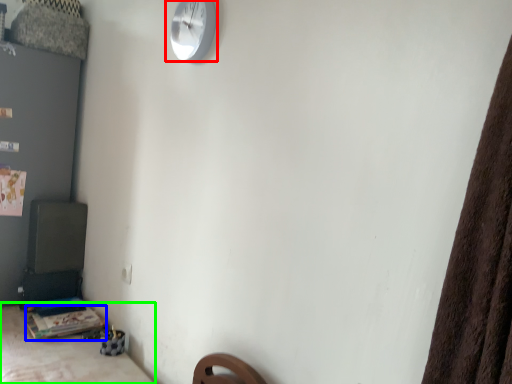
Question: Which object is the farthest from wall clock (highlighted by a red box)? Choose among these: table (highlighted by a blue box) or furniture (highlighted by a green box).

Choices:
 (A) table
 (B) furniture

Answer: (A)